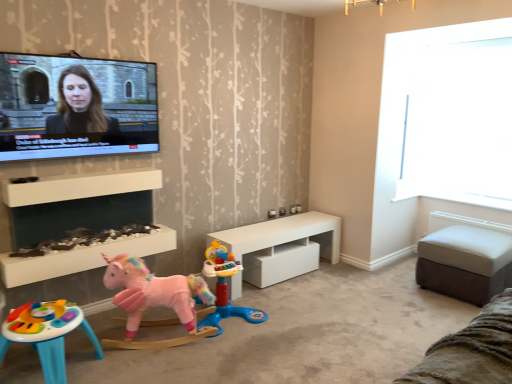
Where is `free spot in front of white glossy table at center, which is the 1th table from left to right`? The width and height of the screenshot is (512, 384). free spot in front of white glossy table at center, which is the 1th table from left to right is located at coordinates (313, 311).